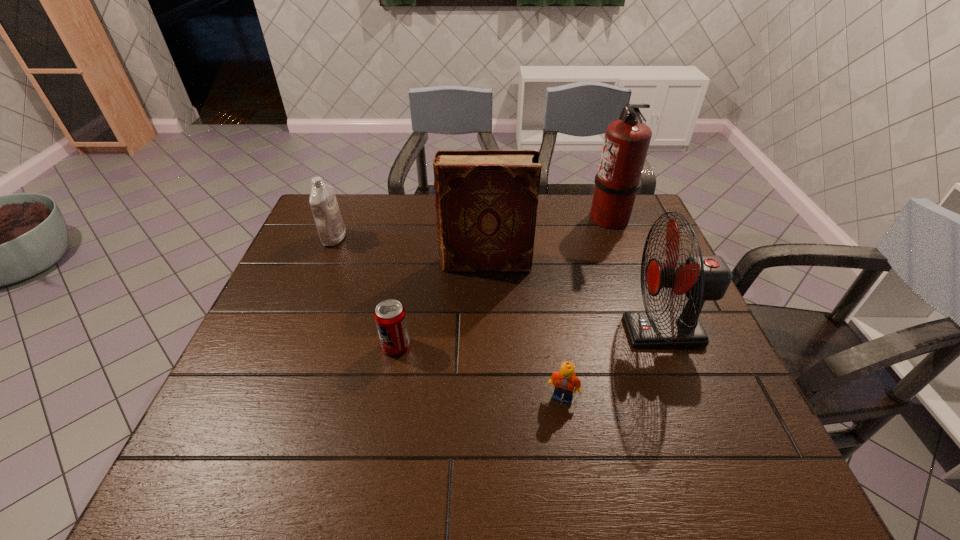
Find the location of a particular element. This screenshot has height=540, width=960. free region at the near left corner of the desktop is located at coordinates (208, 446).

In the image, there is a desktop. Where is `free space at the far right corner`? free space at the far right corner is located at coordinates (641, 215).

What are the coordinates of `free spot between the hardback book and the detergent` in the screenshot? It's located at (410, 251).

I want to click on free spot between the fan and the fourth nearest object, so click(x=574, y=298).

Identify the location of free space between the fourth nearest object and the fan. The width and height of the screenshot is (960, 540). pos(574,298).

I want to click on vacant space that is in between the fire extinguisher and the Lego, so click(586, 307).

Locate an element on the screen. blank region between the hardback book and the fan is located at coordinates pyautogui.click(x=574, y=298).

Identify the location of free space between the nearest object and the fan. (612, 364).

At what (x,y) coordinates should I click in order to perform the action: click on empty space that is in between the third shortest object and the nearest object. Please return your answer as a coordinate pair (x, y). This screenshot has width=960, height=540. Looking at the image, I should click on (448, 318).

Locate an element on the screen. Image resolution: width=960 pixels, height=540 pixels. vacant space that's between the Lego and the fan is located at coordinates (612, 364).